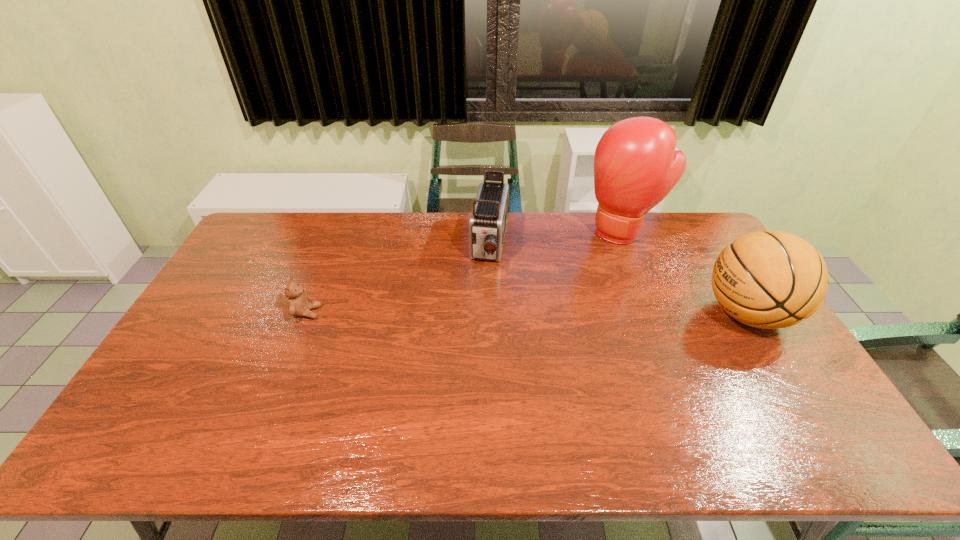
Locate an element on the screen. the shortest object is located at coordinates (298, 305).

Where is `teddy bear`? Image resolution: width=960 pixels, height=540 pixels. teddy bear is located at coordinates (298, 305).

At what (x,y) coordinates should I click in order to perform the action: click on basketball. Please return your answer as a coordinate pair (x, y). The height and width of the screenshot is (540, 960). Looking at the image, I should click on (771, 279).

Identify the location of the third object from right to left. Image resolution: width=960 pixels, height=540 pixels. (487, 225).

The width and height of the screenshot is (960, 540). I want to click on camcorder, so click(487, 225).

Identify the location of the tallest object. (636, 166).

In order to click on vacant space located 0.190m on the face of the teddy bear in this screenshot , I will do coord(382,313).

Where is `vacant space situated 0.070m on the surface of the basketball near the brand logo`? The height and width of the screenshot is (540, 960). vacant space situated 0.070m on the surface of the basketball near the brand logo is located at coordinates 679,314.

I want to click on vacant region located on the surface of the basketball near the brand logo, so click(633, 314).

Find the location of a particular element. free space located 0.100m on the surface of the basketball near the brand logo is located at coordinates point(669,314).